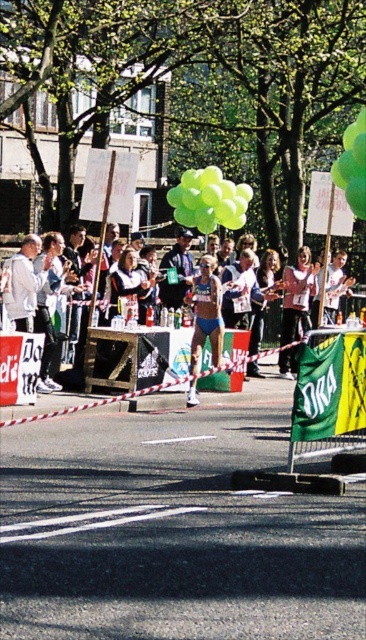
Question: Which is nearer to the matte blue shorts at center?

Choices:
 (A) green fabric banner at lower right
 (B) green rubber balloons at upper center
 (C) green rubber balloon at upper center
 (D) matte black shirt at center

Answer: (B)

Question: Which point is farther to the camera?

Choices:
 (A) matte black shirt at center
 (B) green rubber balloon at upper center

Answer: (A)

Question: Is white hoodie at left positioned before matte black shirt at center?

Choices:
 (A) no
 (B) yes

Answer: (B)

Question: Is green rubber balloon at upper center smaller than matte black shirt at center?

Choices:
 (A) no
 (B) yes

Answer: (A)

Question: Among these objects, which one is farthest from the camera?

Choices:
 (A) white cotton jacket at center
 (B) white hoodie at left
 (C) matte blue shorts at center
 (D) green fabric banner at lower right

Answer: (A)

Question: Observing the image, what is the correct spatial positioning of white hoodie at left in reference to matte blue shorts at center?

Choices:
 (A) above
 (B) below

Answer: (A)